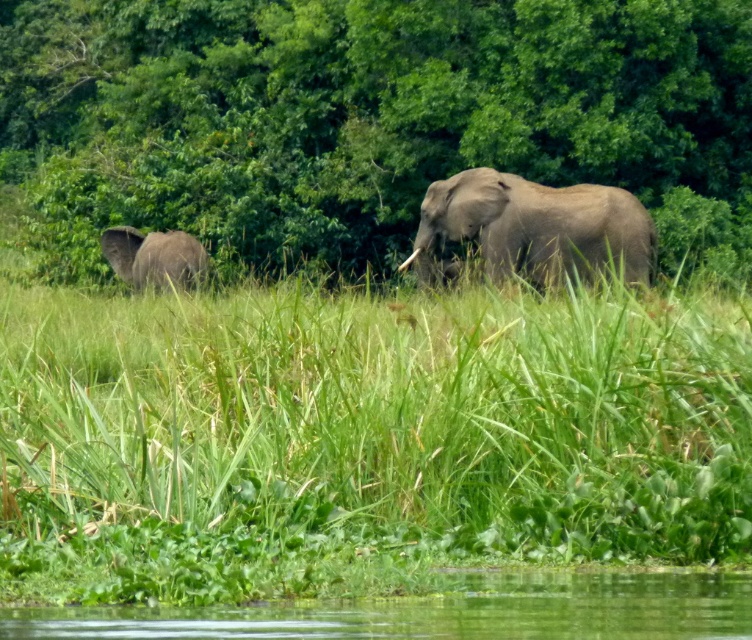
You are standing at the point marked by the coordinates point (532, 227). Looking around, you see a gray matte elephant at center. Which direction should you walk to reach the nearest water area?

The point (532, 227) is on the gray matte elephant at center, so you should walk forward to reach the nearest water area located at the bottom edge of the frame.

You are standing at the camera position and want to reach the point marked at coordinates (559,188). The elephants are blocking your path. Which elephant is closer to you so you can go around it?

The elephant closer to the camera is only 85.79 feet away from you, so you should go around that one first.